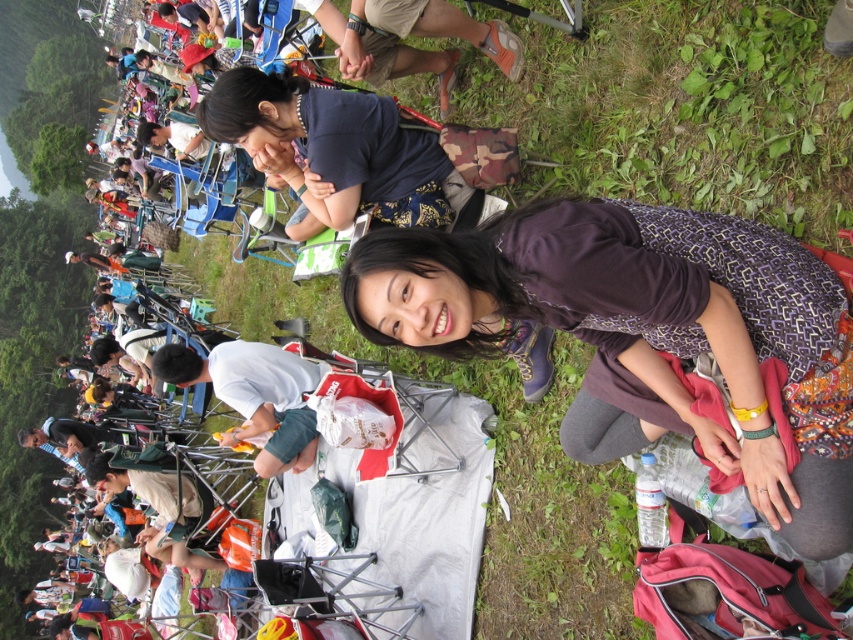
Is purple printed dress at center in front of dark blue fabric at center?

That is True.

You are a GUI agent. You are given a task and a screenshot of the screen. Output one action in this format:
    pyautogui.click(x=<x>, y=<y>)
    Task: Click on the purple printed dress at center
    Image resolution: width=853 pixels, height=640 pixels.
    Given the screenshot: What is the action you would take?
    pyautogui.click(x=645, y=333)

Where is `purple printed dress at center`? The height and width of the screenshot is (640, 853). purple printed dress at center is located at coordinates (645, 333).

Is purple printed dress at center behind white cotton shirt at lower left?

No, it is not.

Who is more distant from viewer, (619, 227) or (244, 397)?

Point (244, 397)

You are a GUI agent. You are given a task and a screenshot of the screen. Output one action in this format:
    pyautogui.click(x=<x>, y=<y>)
    Task: Click on the purple printed dress at center
    
    Given the screenshot: What is the action you would take?
    pyautogui.click(x=645, y=333)

The height and width of the screenshot is (640, 853). Find the location of `purple printed dress at center`. purple printed dress at center is located at coordinates point(645,333).

Which of these two, dark blue fabric at center or white cotton shirt at lower left, stands taller?

white cotton shirt at lower left is taller.

Does point (444, 154) come closer to viewer compared to point (312, 445)?

Yes, point (444, 154) is in front of point (312, 445).

Where is `dark blue fabric at center`? The height and width of the screenshot is (640, 853). dark blue fabric at center is located at coordinates [334, 147].